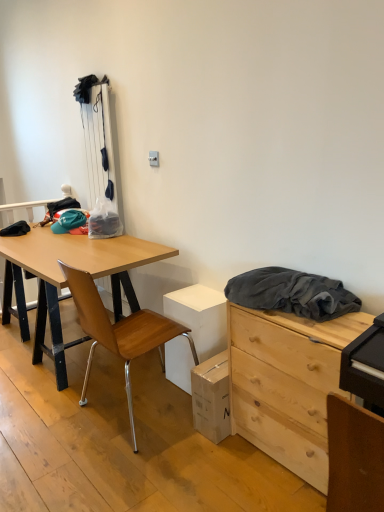
Question: Considering the positions of natural wood chest of drawers at right and wooden at left in the image, is natural wood chest of drawers at right wider or thinner than wooden at left?

Choices:
 (A) wide
 (B) thin

Answer: (B)

Question: From the image's perspective, is natural wood chest of drawers at right located above or below wooden at left?

Choices:
 (A) below
 (B) above

Answer: (A)

Question: Which object is positioned closest to the dark gray fabric at upper right?

Choices:
 (A) wooden at left
 (B) natural wood chest of drawers at right

Answer: (B)

Question: Estimate the real-world distances between objects in this image. Which object is closer to the wooden at left?

Choices:
 (A) natural wood chest of drawers at right
 (B) dark gray fabric at upper right

Answer: (A)